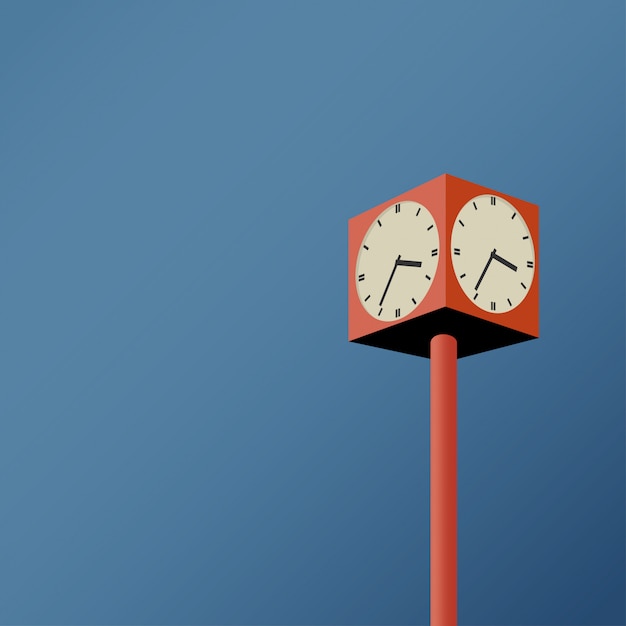
Where is `front of clock`? Image resolution: width=626 pixels, height=626 pixels. front of clock is located at coordinates (452, 193).